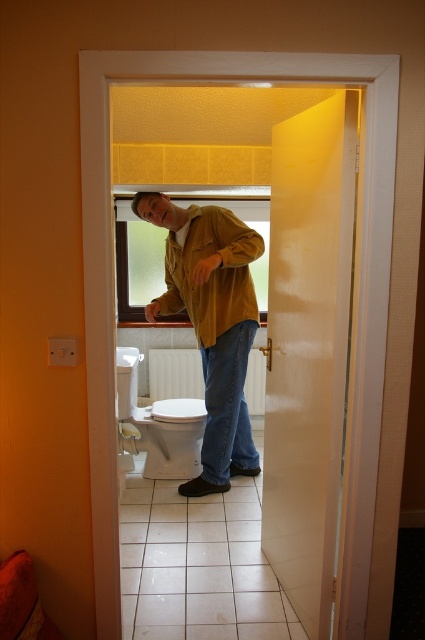
Question: Does matte yellow jacket at center appear on the right side of white glossy toilet bowl at center?

Choices:
 (A) no
 (B) yes

Answer: (B)

Question: Among these points, which one is farthest from the camera?

Choices:
 (A) (161, 419)
 (B) (186, 252)

Answer: (A)

Question: Does matte yellow jacket at center appear on the left side of white glossy toilet bowl at center?

Choices:
 (A) no
 (B) yes

Answer: (A)

Question: Which object is closer to the camera taking this photo?

Choices:
 (A) white glossy toilet bowl at center
 (B) matte yellow jacket at center

Answer: (B)

Question: Among these points, which one is nearest to the camera?

Choices:
 (A) (192, 440)
 (B) (235, 276)

Answer: (B)

Question: Is matte yellow jacket at center wider than white glossy toilet bowl at center?

Choices:
 (A) yes
 (B) no

Answer: (A)